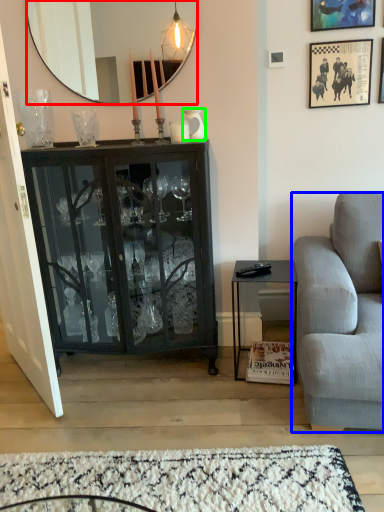
Question: Which object is the closest to the mirror (highlighted by a red box)? Choose among these: studio couch (highlighted by a blue box) or vase (highlighted by a green box).

Choices:
 (A) studio couch
 (B) vase

Answer: (B)